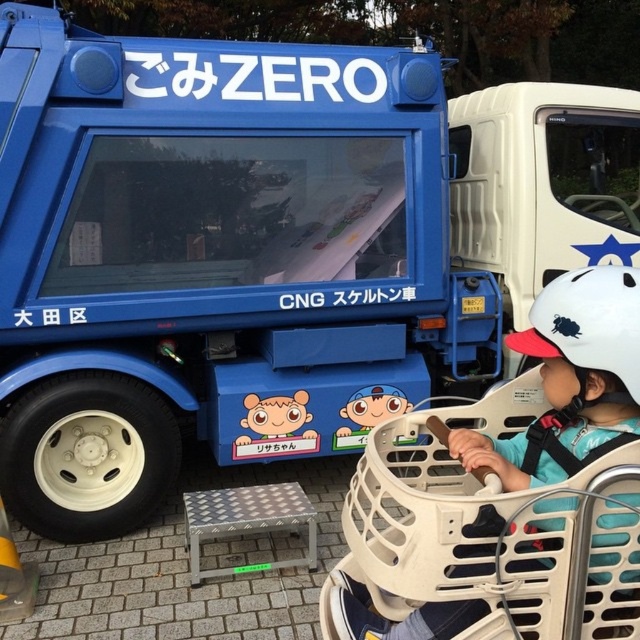
You are a delivery person who needs to pick up a helmet to ride a bike. You see two white matte helmets in the image. Which one is positioned lower between the white matte helmet at upper right and the white matte helmet at center?

The white matte helmet at upper right is located below the white matte helmet at center, so the white matte helmet at upper right is positioned lower.

You are a delivery person who needs to pick up a helmet. You see a white matte helmet at upper right and a white matte helmet at center. Which one is closer to you?

Both helmets are white matte helmets, but the white matte helmet at center is closer to you than the white matte helmet at upper right.